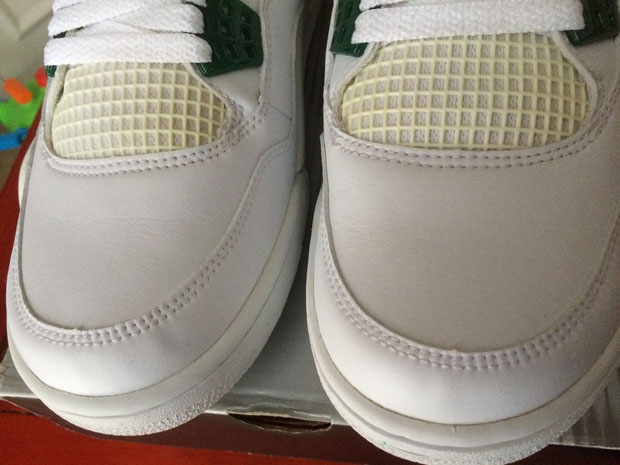
I want to click on shoe box, so click(x=284, y=383).